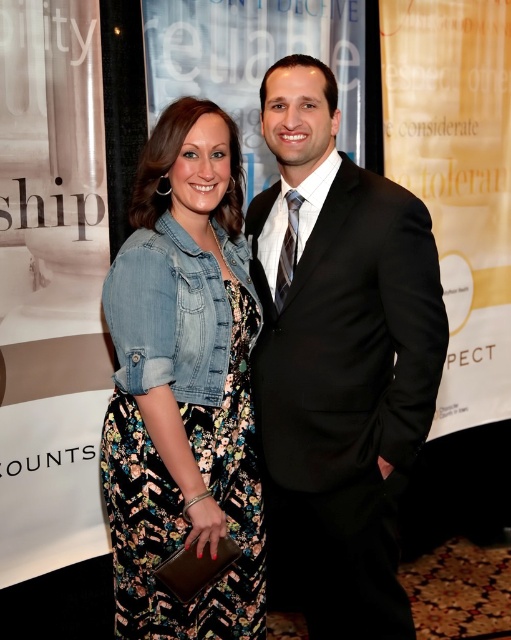
Based on the photo, you are a photographer adjusting your camera settings to focus on both the black satin suit at center and the denim jacket at center. Which one should you focus on first to ensure proper depth of field?

The black satin suit at center is closer to the viewer than the denim jacket at center, so you should focus on the black satin suit at center first to ensure proper depth of field.

You are a photographer at a formal event. You need to adjust the camera focus so that both the woman in the floral dress on the left and the man in the black satin suit at center are in sharp focus. The depth of field allows for a focus range of 5 feet. Can you capture both subjects clearly in the same shot?

The distance between the woman in the floral dress on the left and the man in the black satin suit at center is 5.10 feet. Since the depth of field only covers 5 feet, it will be challenging to keep both in focus simultaneously. Adjusting the camera settings or moving closer to reduce the distance might help achieve the desired focus.

You are a photographer trying to capture a closeup shot of both the black satin suit at center and the denim jacket at center. Given that your camera has a maximum focus range of 10 inches, will you be able to focus on both subjects simultaneously?

The black satin suit at center is 9.56 inches away from the denim jacket at center. Since the distance between them is within the camera maximum focus range of 10 inches, the camera can focus on both subjects simultaneously.